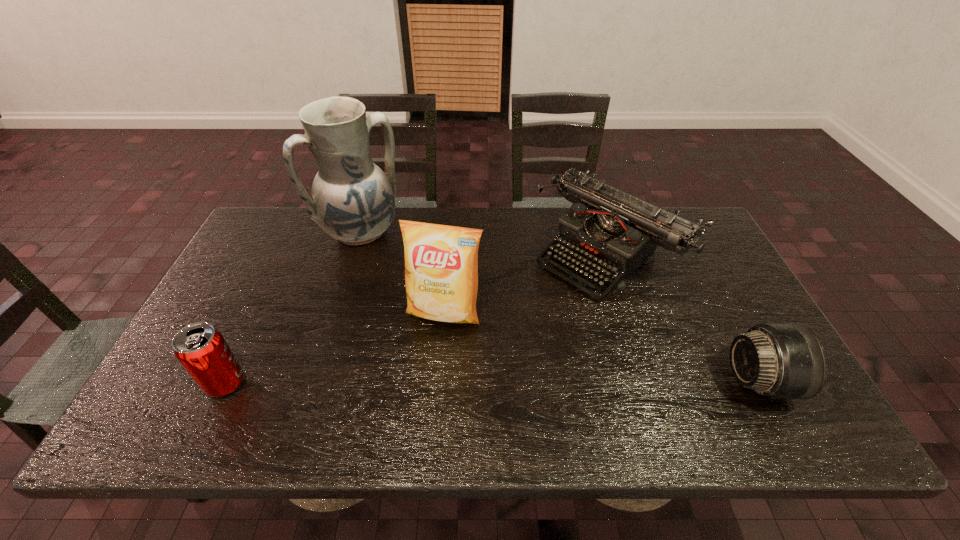
In the image, there is a desktop. Identify the location of free space at the far left corner. The height and width of the screenshot is (540, 960). (296, 239).

Image resolution: width=960 pixels, height=540 pixels. In the image, there is a desktop. In order to click on vacant space at the near left corner in this screenshot , I will do tap(210, 399).

Where is `free area in between the telephoto lens and the soda can`? The height and width of the screenshot is (540, 960). free area in between the telephoto lens and the soda can is located at coordinates (492, 382).

Find the location of `vacant point located between the telephoto lens and the leftmost object`. vacant point located between the telephoto lens and the leftmost object is located at coordinates (492, 382).

Find the location of a particular element. This screenshot has height=540, width=960. free space between the tallest object and the crisp (potato chip) is located at coordinates (402, 273).

Identify the location of free point between the telephoto lens and the typewriter. (684, 317).

This screenshot has width=960, height=540. I want to click on vacant region between the second tallest object and the telephoto lens, so click(602, 348).

The height and width of the screenshot is (540, 960). Find the location of `free space that is in between the telephoto lens and the soda can`. free space that is in between the telephoto lens and the soda can is located at coordinates (492, 382).

Locate an element on the screen. The image size is (960, 540). free space between the pitcher and the typewriter is located at coordinates (484, 242).

Find the location of a particular element. The image size is (960, 540). vacant region between the typewriter and the pitcher is located at coordinates (484, 242).